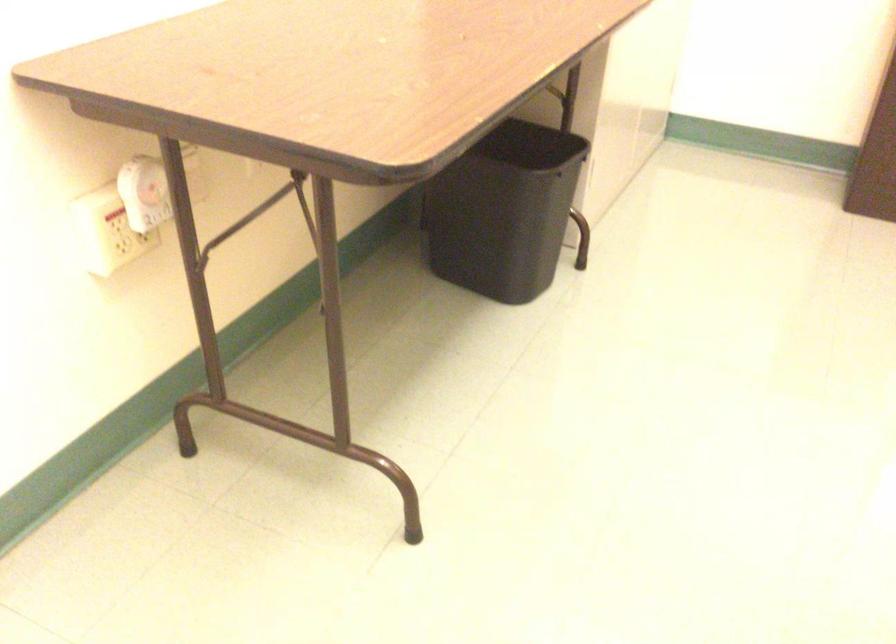
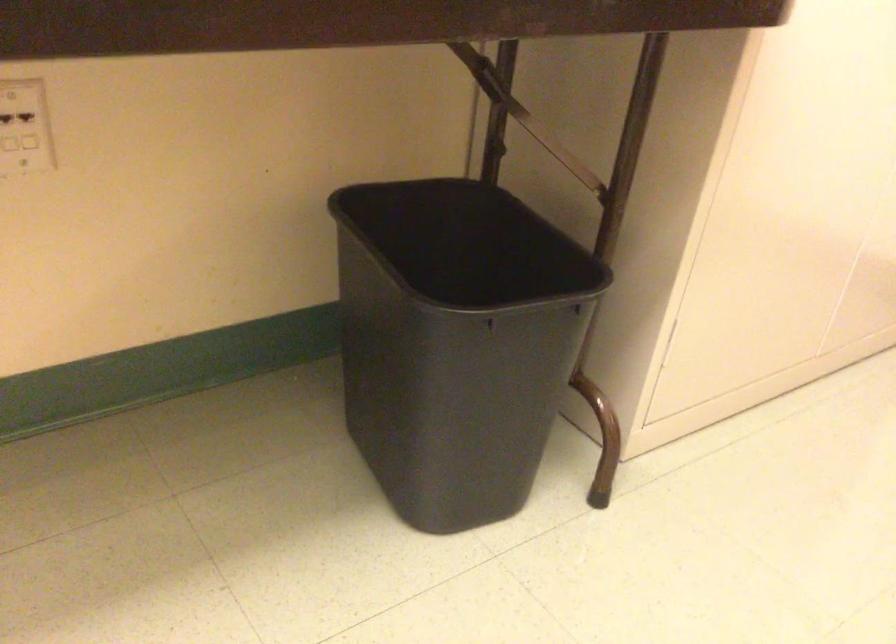
Which direction would the cameraman need to move to produce the second image?

The movement direction of the cameraman is right, forward.